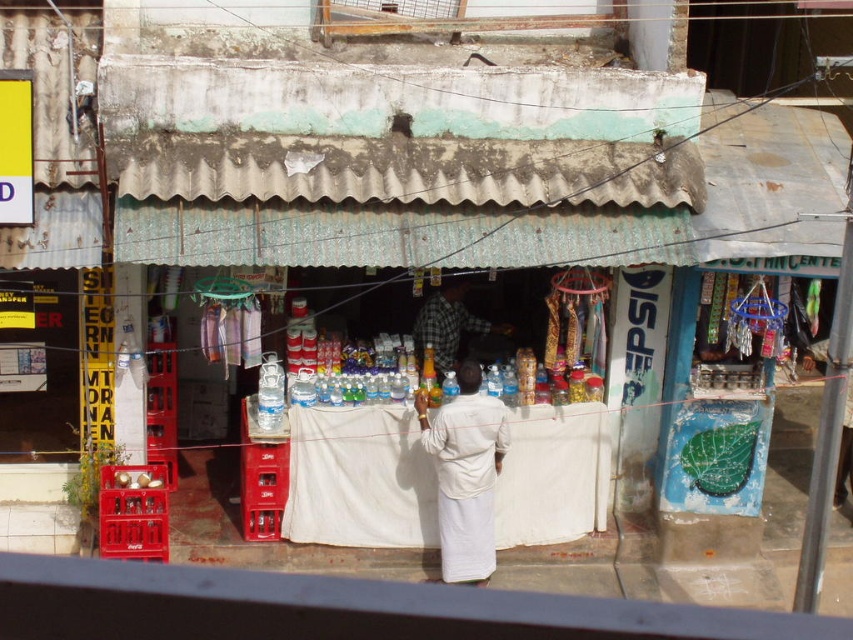
You are a customer at the shop and want to buy a thin fabric item. Which item would you choose between the white cotton robe at center and the checkered fabric shirt at center?

The white cotton robe at center is thinner than the checkered fabric shirt at center, so you should choose the white cotton robe at center.

You are a customer standing in front of the shop and see the white cotton robe at center and the checkered fabric shirt at center. Which one is closer to you?

The white cotton robe at center is closer to you because it is in front of the checkered fabric shirt at center.